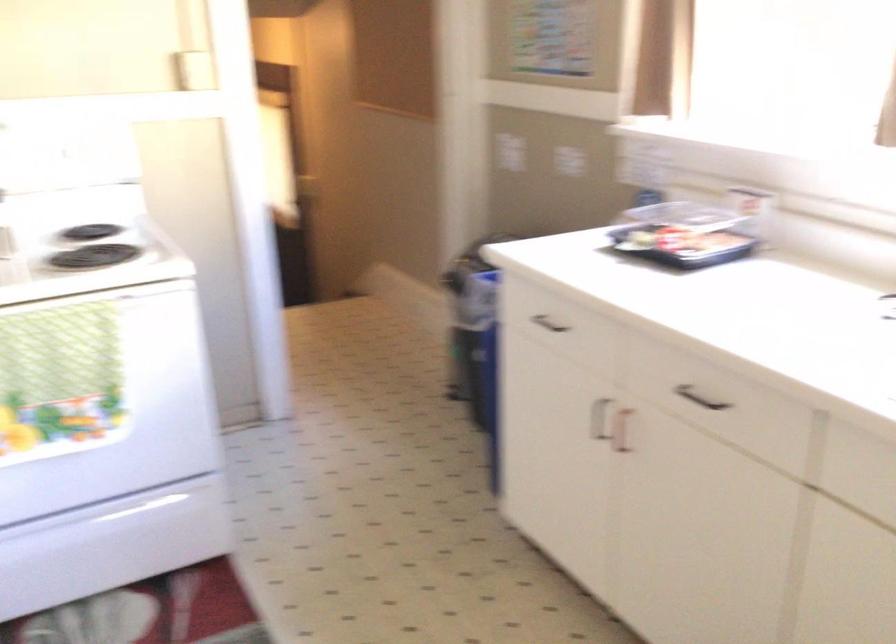
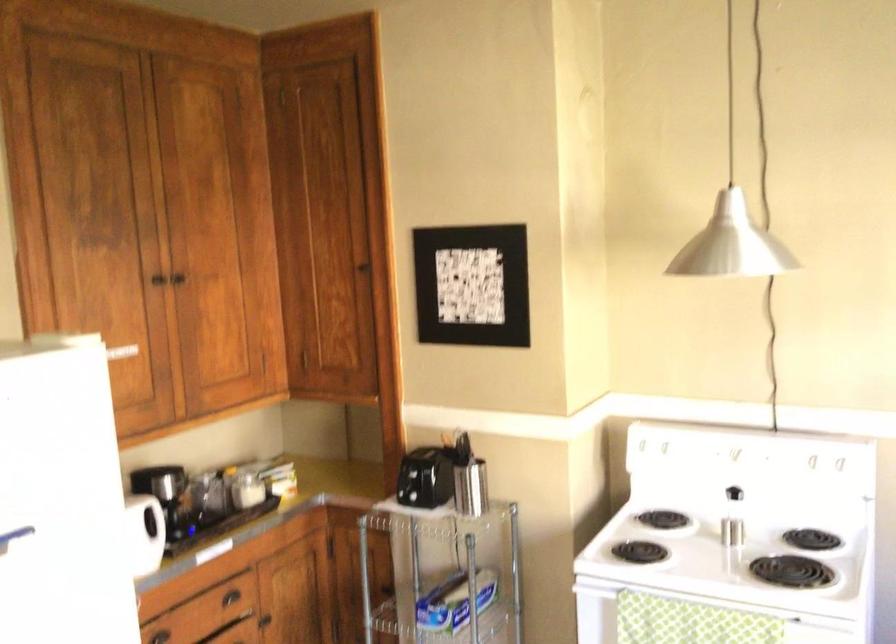
Question: The camera is either moving clockwise (left) or counter-clockwise (right) around the object. The first image is from the beginning of the video and the second image is from the end. Is the camera moving left or right when shooting the video?

Choices:
 (A) Left
 (B) Right

Answer: (B)